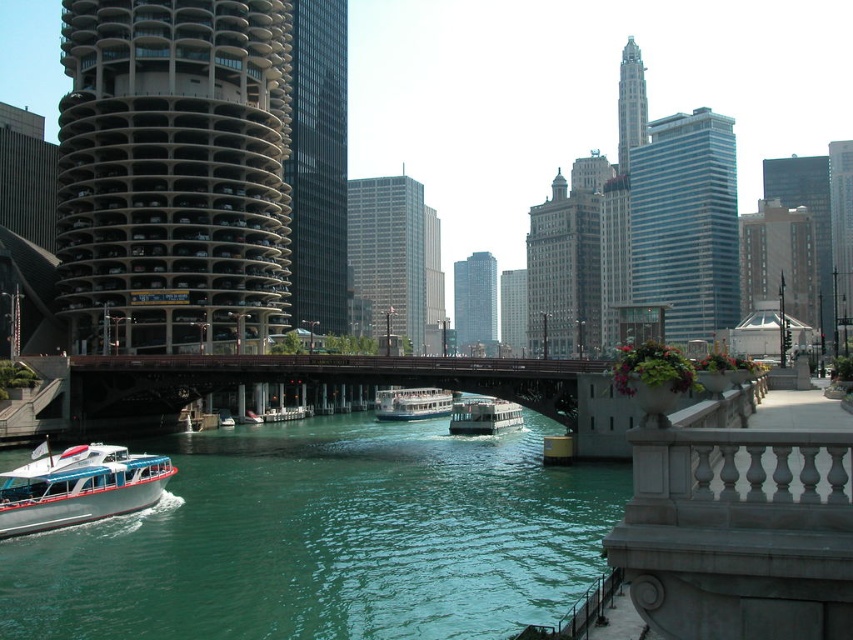
You are a photographer planning to capture the entire scene of the green water at lower left and the white glossy boat at center in a single shot. Given that your camera can only focus on one object at a time, which object should you prioritize focusing on to ensure the other remains in the background?

Since the green water at lower left is bigger than the white glossy boat at center, you should focus on the green water at lower left to keep the smaller boat in the background.

You are standing at the Marina City building and want to reach the point marked at coordinates point (198, 454). If you have a drone that can fly 100 meters, will it be able to reach the point from your current location?

The point marked at coordinates point (198, 454) is 70.71 meters away from the viewer. Since the drone can fly 100 meters, it will be able to reach the point from the current location.

You are a photographer standing at the edge of the river in Chicago, aiming to capture the white glossy boat at lower left and the green water at lower left in your shot. Based on their sizes, which one will occupy more space in your photo?

The green water at lower left occupies more space in the photo because it has a larger size compared to the white glossy boat at lower left.